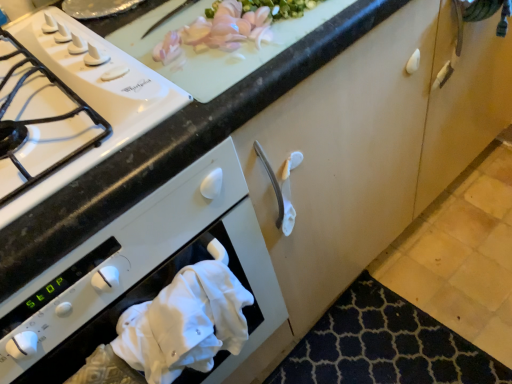
Question: From a real-world perspective, is white glossy gas stove at left positioned over dark blue textured mat at lower right based on gravity?

Choices:
 (A) yes
 (B) no

Answer: (A)

Question: Can you confirm if white glossy gas stove at left is wider than dark blue textured mat at lower right?

Choices:
 (A) yes
 (B) no

Answer: (A)

Question: Is white glossy gas stove at left not close to dark blue textured mat at lower right?

Choices:
 (A) no
 (B) yes

Answer: (A)

Question: Is white glossy gas stove at left positioned before dark blue textured mat at lower right?

Choices:
 (A) yes
 (B) no

Answer: (A)

Question: From the image's perspective, is white glossy gas stove at left under dark blue textured mat at lower right?

Choices:
 (A) no
 (B) yes

Answer: (A)

Question: From the image's perspective, is white glossy gas stove at left on top of dark blue textured mat at lower right?

Choices:
 (A) no
 (B) yes

Answer: (B)

Question: Is white glossy gas stove at left surrounded by white cotton hand towel at lower left?

Choices:
 (A) no
 (B) yes

Answer: (A)

Question: Does white cotton hand towel at lower left appear on the right side of white glossy gas stove at left?

Choices:
 (A) yes
 (B) no

Answer: (A)

Question: Is white cotton hand towel at lower left not within white glossy gas stove at left?

Choices:
 (A) yes
 (B) no

Answer: (A)

Question: Is white cotton hand towel at lower left thinner than white glossy gas stove at left?

Choices:
 (A) no
 (B) yes

Answer: (B)

Question: Is white cotton hand towel at lower left taller than white glossy gas stove at left?

Choices:
 (A) yes
 (B) no

Answer: (A)

Question: Is white cotton hand towel at lower left in front of white glossy gas stove at left?

Choices:
 (A) yes
 (B) no

Answer: (B)

Question: Is white cloth at lower left wider than white cotton hand towel at lower left?

Choices:
 (A) no
 (B) yes

Answer: (A)